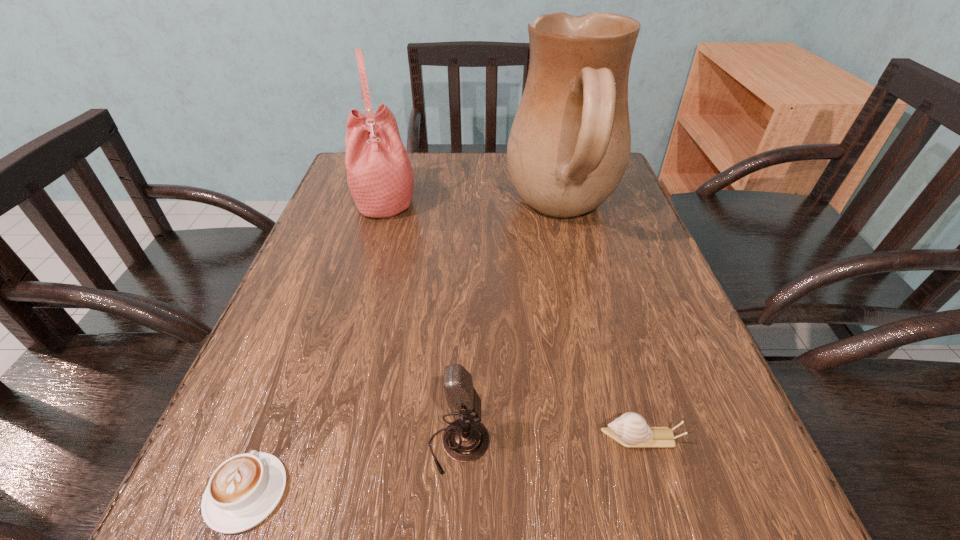
Identify the location of vacant space at the right edge of the desktop. (629, 275).

In the image, there is a desktop. Where is `vacant area at the near right corner`? The height and width of the screenshot is (540, 960). vacant area at the near right corner is located at coordinates (705, 499).

The width and height of the screenshot is (960, 540). Identify the location of vacant point located between the escargot and the cappuccino. (444, 465).

This screenshot has width=960, height=540. Find the location of `vacant region between the cream pitcher and the escargot`. vacant region between the cream pitcher and the escargot is located at coordinates (602, 326).

Locate an element on the screen. The height and width of the screenshot is (540, 960). unoccupied area between the cream pitcher and the escargot is located at coordinates (602, 326).

The image size is (960, 540). I want to click on empty space between the fourth shortest object and the third tallest object, so click(x=421, y=323).

Image resolution: width=960 pixels, height=540 pixels. What are the coordinates of `free space that is in between the microphone and the cappuccino` in the screenshot? It's located at pyautogui.click(x=352, y=469).

You are a GUI agent. You are given a task and a screenshot of the screen. Output one action in this format:
    pyautogui.click(x=<x>, y=<y>)
    Task: Click on the free space between the cappuccino and the third shortest object
    
    Given the screenshot: What is the action you would take?
    pyautogui.click(x=352, y=469)

The image size is (960, 540). I want to click on vacant space in between the cappuccino and the third tallest object, so click(x=352, y=469).

Identify the location of free space that is in between the escargot and the second tallest object. (513, 319).